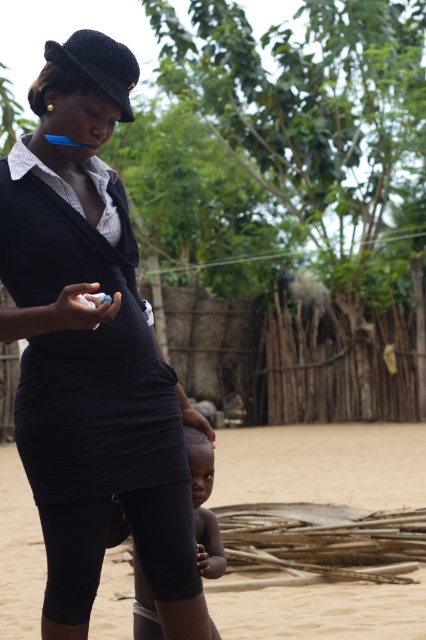
You are a photographer trying to capture a closeup of the dark skin baby at lower center. However, the black matte dress at center is blocking your view. Can you adjust your position to get the shot without moving any subjects?

The black matte dress at center is closer to the viewer than the dark skin baby at lower center. Therefore, you cannot adjust your position to get a clear shot of the dark skin baby at lower center without moving the black matte dress at center, as it is blocking the view.

You are a photographer trying to capture the dark skin baby at lower center and the brown sandy dirt at center in a single shot. Which object should you focus on first to ensure both are in frame?

The dark skin baby at lower center is behind the brown sandy dirt at center, so you should focus on the brown sandy dirt at center first to ensure both are in frame.

From the picture: You are a photographer positioned at point A. You want to take a photo of the scene while ensuring both the woman and the child are visible. Given the coordinates of two points in the image, point A at (146, 518) and point B at (31, 586), which point should you choose to stand at to ensure the subject in front is fully visible?

Point A at (146, 518) is in front of point B at (31, 586). To ensure the subject in front is fully visible, you should stand at point B at (31, 586) because it is behind point A, allowing you to capture both subjects without obstruction.